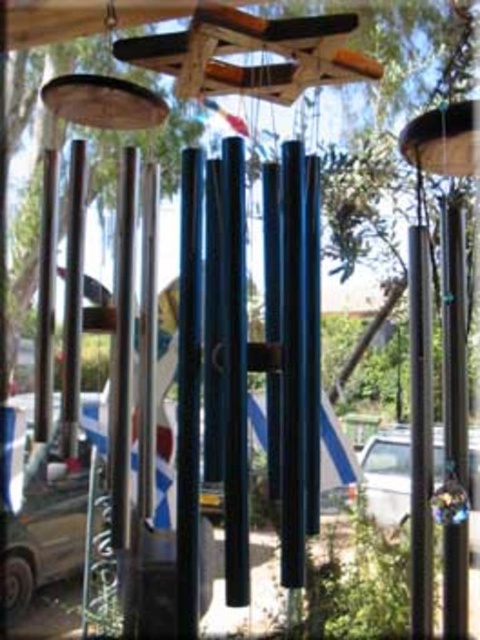
Question: Estimate the real-world distances between objects in this image. Which object is farther from the polished metal pole at center?

Choices:
 (A) white glossy car at center
 (B) black polished pole at right

Answer: (A)

Question: Does metallic silver car at lower left have a smaller size compared to black polished pole at right?

Choices:
 (A) yes
 (B) no

Answer: (B)

Question: Observing the image, what is the correct spatial positioning of metallic silver car at lower left in reference to black polished pole at right?

Choices:
 (A) right
 (B) left

Answer: (B)

Question: Estimate the real-world distances between objects in this image. Which object is farther from the metallic silver car at lower left?

Choices:
 (A) polished metal pole at center
 (B) black polished pole at right

Answer: (B)

Question: Estimate the real-world distances between objects in this image. Which object is farther from the metallic silver car at lower left?

Choices:
 (A) white glossy car at center
 (B) black polished pole at right

Answer: (B)

Question: Is metallic silver car at lower left below polished metal pole at center?

Choices:
 (A) yes
 (B) no

Answer: (A)